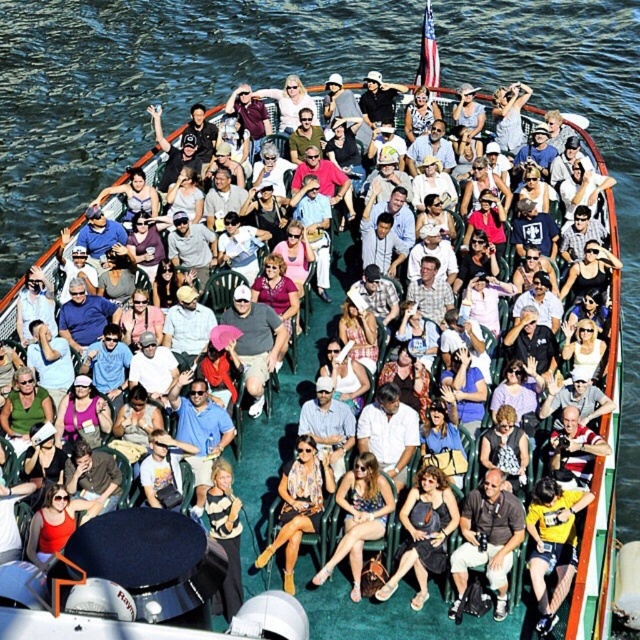
Can you confirm if matte black camera at center is positioned to the right of matte black dress at center?

Indeed, matte black camera at center is positioned on the right side of matte black dress at center.

Can you confirm if matte black camera at center is positioned above matte black dress at center?

Actually, matte black camera at center is below matte black dress at center.

Where is `matte black camera at center`? matte black camera at center is located at coordinates (486, 540).

In the scene shown: How far apart are yellow t-shirt at lower right and striped sweater at center?

yellow t-shirt at lower right and striped sweater at center are 6.78 meters apart.

Who is positioned more to the left, yellow t-shirt at lower right or striped sweater at center?

From the viewer's perspective, striped sweater at center appears more on the left side.

At what (x,y) coordinates should I click in order to perform the action: click on yellow t-shirt at lower right. Please return your answer as a coordinate pair (x, y). The height and width of the screenshot is (640, 640). Looking at the image, I should click on (552, 545).

Where is `yellow t-shirt at lower right`? yellow t-shirt at lower right is located at coordinates (552, 545).

Between matte black camera at center and striped sweater at center, which one appears on the right side from the viewer's perspective?

matte black camera at center is more to the right.

Does matte black camera at center have a greater width compared to striped sweater at center?

Yes.

Is point (467, 516) positioned behind point (212, 497)?

No, it is not.

Find the location of a particular element. The image size is (640, 640). matte black camera at center is located at coordinates (486, 540).